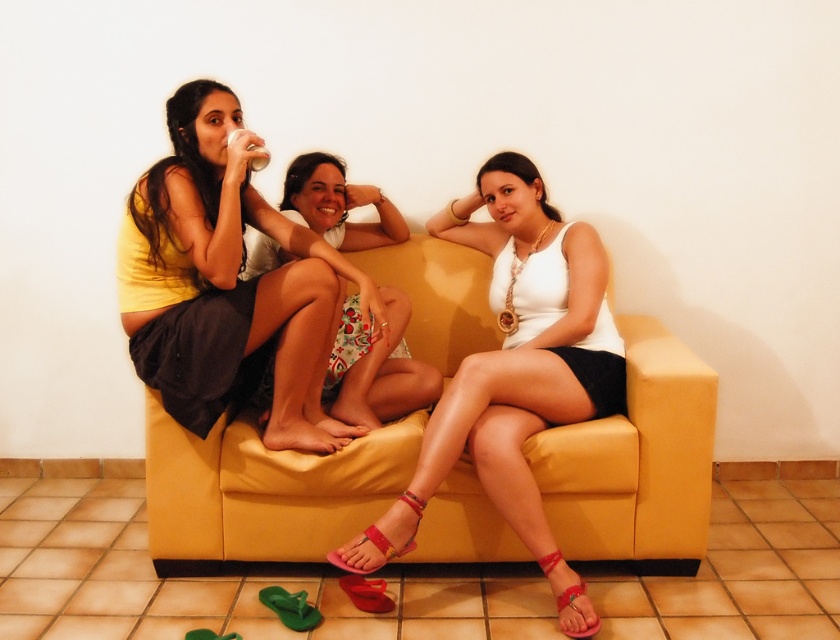
Identify the location of matte yellow dress at upper left. (226, 284).

Which of these two, matte yellow dress at upper left or shiny pink sandal at lower center, stands taller?

matte yellow dress at upper left

Locate an element on the screen. This screenshot has width=840, height=640. matte yellow dress at upper left is located at coordinates (226, 284).

What are the coordinates of `matte yellow dress at upper left` in the screenshot? It's located at (226, 284).

Which is above, white matte tank top at center or matte pink sandal at lower right?

Positioned higher is white matte tank top at center.

Does white matte tank top at center have a lesser width compared to matte pink sandal at lower right?

Incorrect, white matte tank top at center's width is not less than matte pink sandal at lower right's.

Who is more forward, (501, 316) or (563, 598)?

Positioned in front is point (563, 598).

Find the location of `white matte tank top at center`. white matte tank top at center is located at coordinates (512, 358).

Does yellow fabric couch at center appear on the right side of matte yellow dress at upper left?

Yes, yellow fabric couch at center is to the right of matte yellow dress at upper left.

Can you confirm if yellow fabric couch at center is smaller than matte yellow dress at upper left?

No.

Is point (505, 544) positioned behind point (297, 353)?

Yes, it is.

This screenshot has height=640, width=840. Identify the location of yellow fabric couch at center. (263, 492).